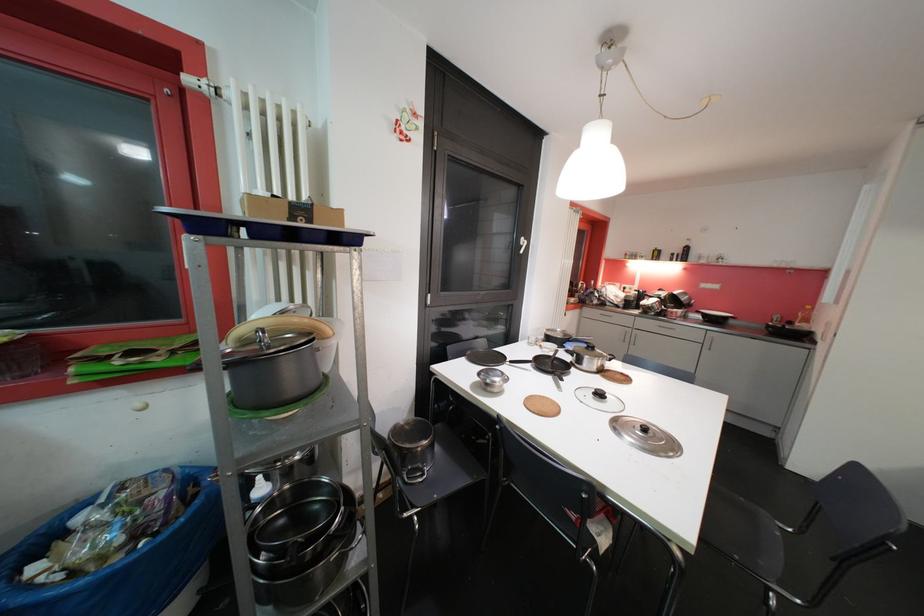
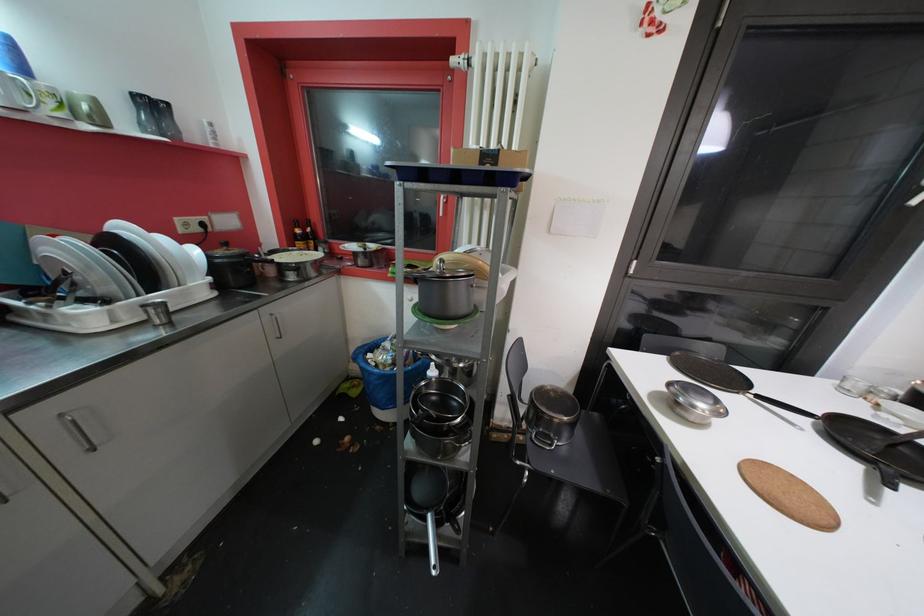
Question: The images are taken continuously from a first-person perspective. In which direction is your viewpoint rotating?

Choices:
 (A) Left
 (B) Right
 (C) Up
 (D) Down

Answer: (A)